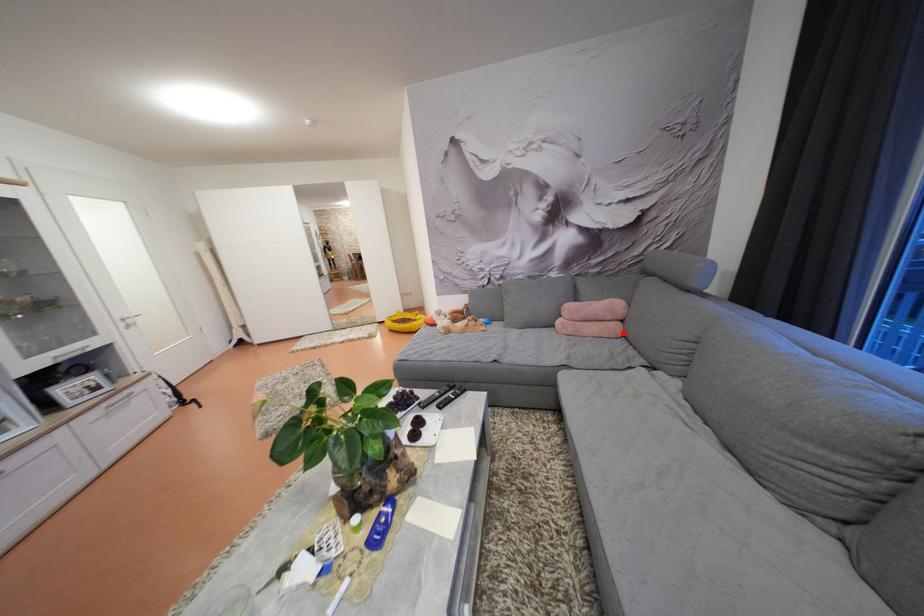
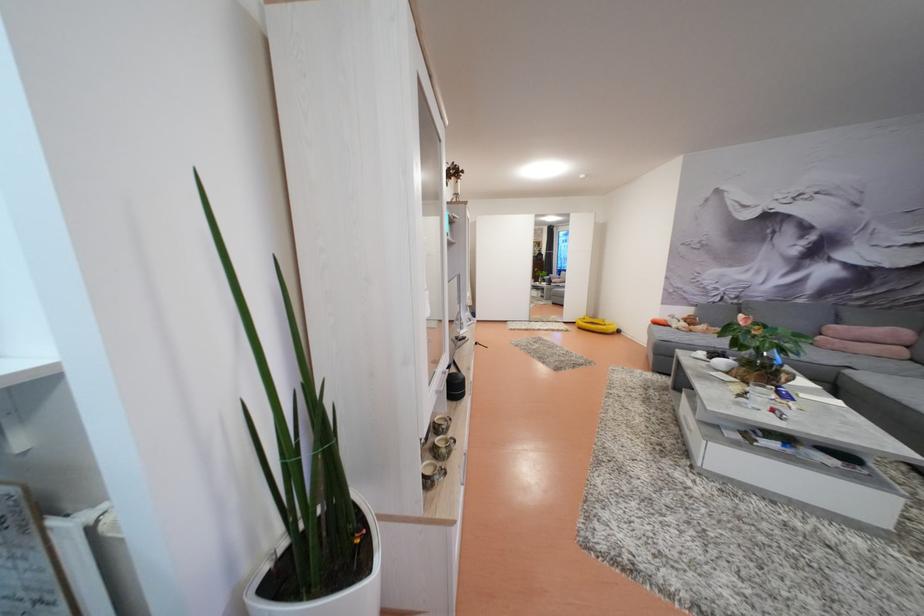
Question: I am providing you with two images of the same scene from different viewpoints. A red point is shown in image1. For the corresponding object point in image2, is it positioned nearer or farther from the camera?

Choices:
 (A) Nearer
 (B) Farther

Answer: (B)